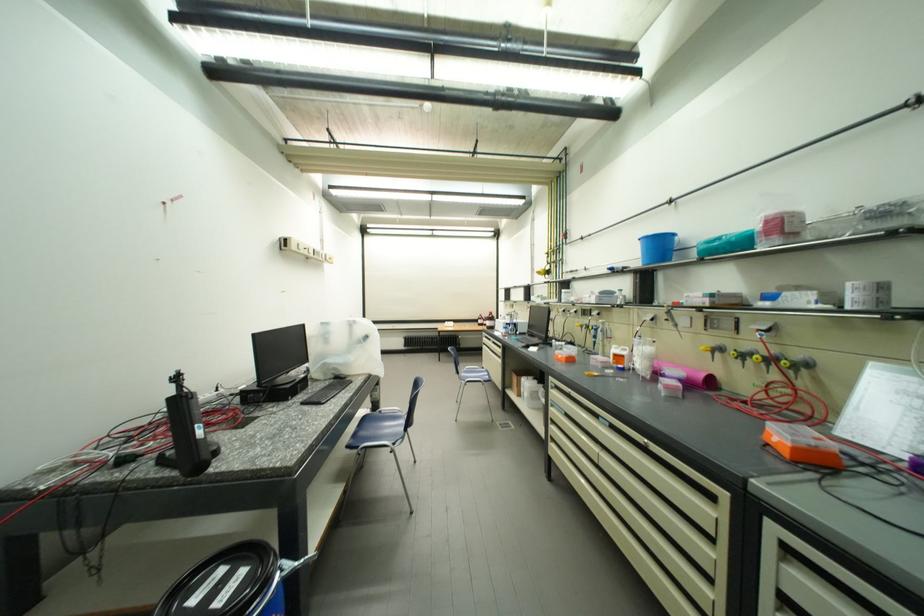
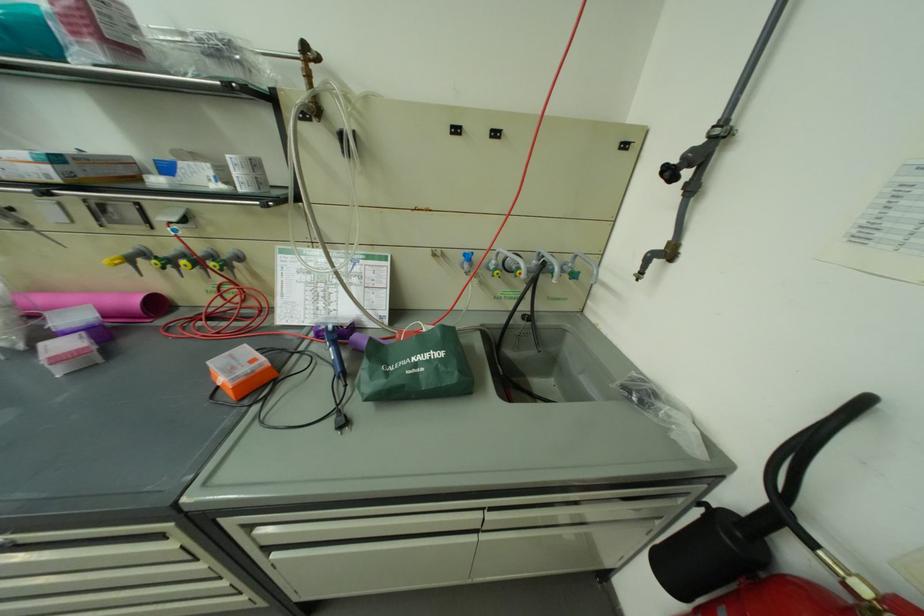
How did the camera likely rotate?

The camera's rotation is toward right-down.